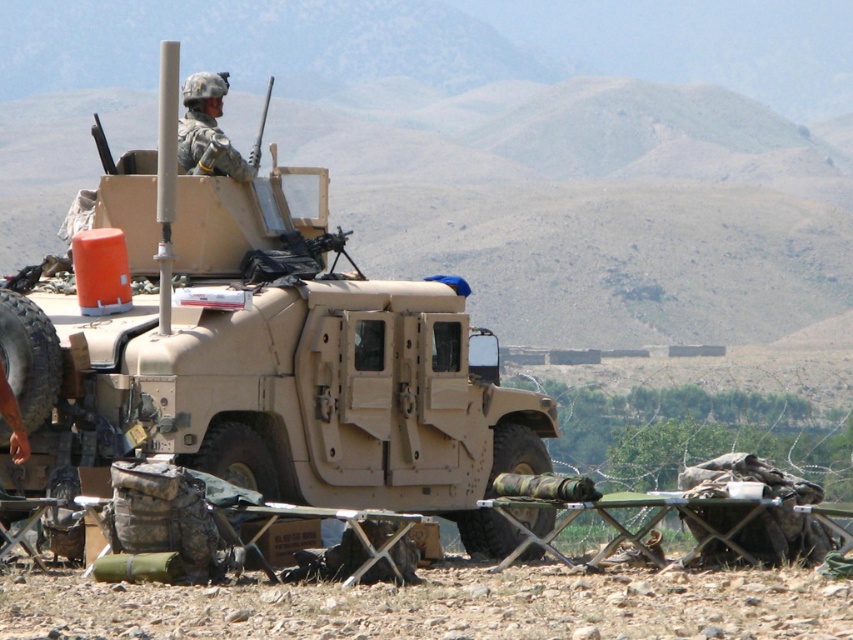
Is tan matte military vehicle at center shorter than camouflage helmet at upper center?

Correct, tan matte military vehicle at center is not as tall as camouflage helmet at upper center.

Identify the location of tan matte military vehicle at center. (262, 353).

Where is `tan matte military vehicle at center`? Image resolution: width=853 pixels, height=640 pixels. tan matte military vehicle at center is located at coordinates (262, 353).